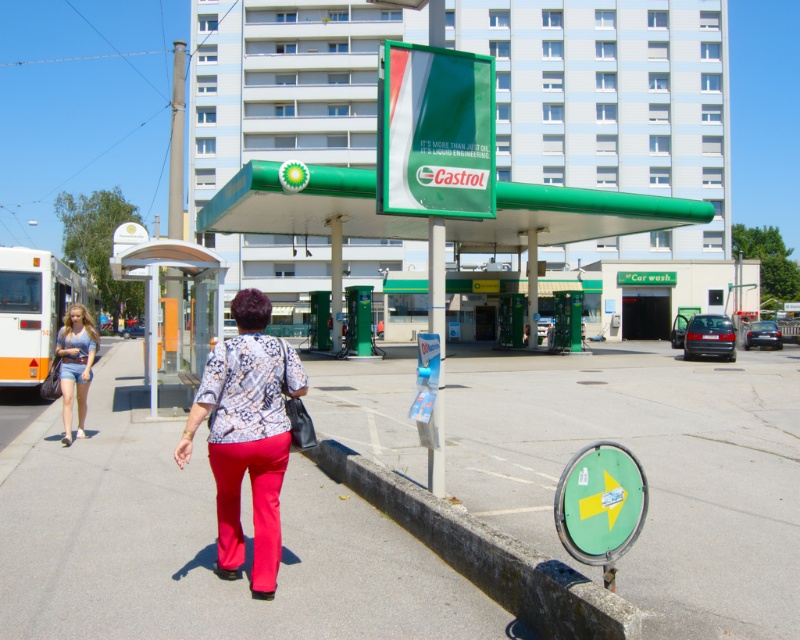
Question: Is patterned fabric blouse at center bigger than concrete at lower right?

Choices:
 (A) yes
 (B) no

Answer: (B)

Question: Is concrete at lower right bigger than matte red pants at center?

Choices:
 (A) yes
 (B) no

Answer: (A)

Question: Which of the following is the closest to the observer?

Choices:
 (A) concrete at lower right
 (B) white matte bus at left

Answer: (A)

Question: Which object is farther from the camera taking this photo?

Choices:
 (A) white metallic bus stop at left
 (B) denim shorts at left

Answer: (A)

Question: Which of the following is the farthest from the observer?

Choices:
 (A) (220, 320)
 (B) (478, 576)

Answer: (A)

Question: Is white matte bus at left thinner than matte red pants at center?

Choices:
 (A) yes
 (B) no

Answer: (B)